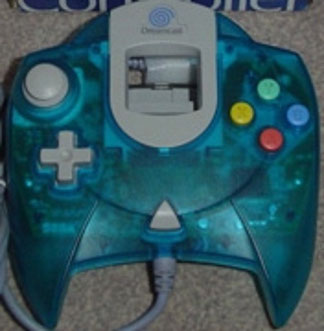
I want to click on game console, so click(188, 199).